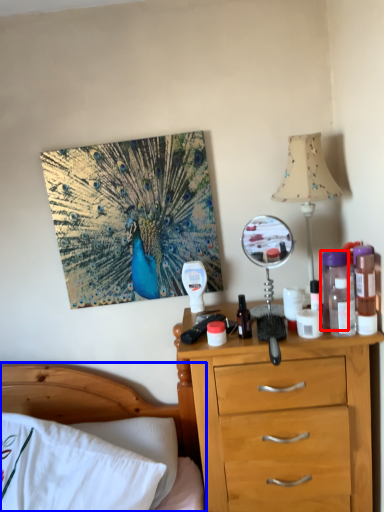
Question: Which object is further to the camera taking this photo, bottle (highlighted by a red box) or bed (highlighted by a blue box)?

Choices:
 (A) bottle
 (B) bed

Answer: (A)